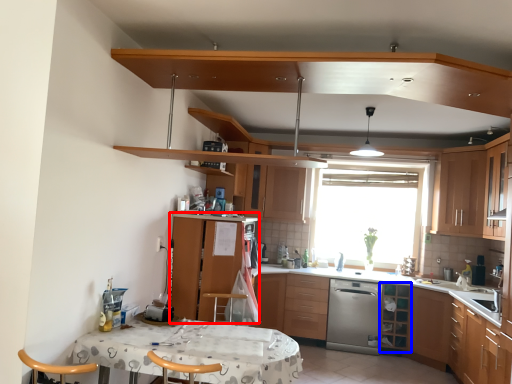
Question: Which of the following is the farthest to the observer, cabinetry (highlighted by a red box) or shelf (highlighted by a blue box)?

Choices:
 (A) cabinetry
 (B) shelf

Answer: (B)